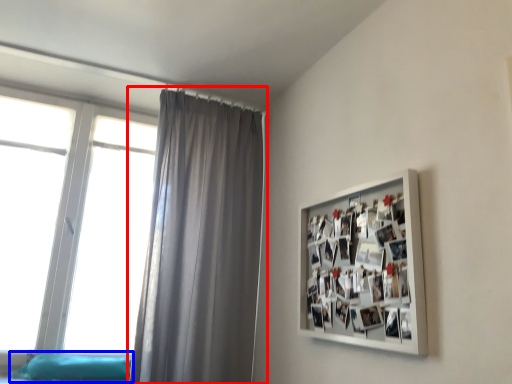
Question: Which object appears farthest to the camera in this image, curtain (highlighted by a red box) or bed frame (highlighted by a blue box)?

Choices:
 (A) curtain
 (B) bed frame

Answer: (B)